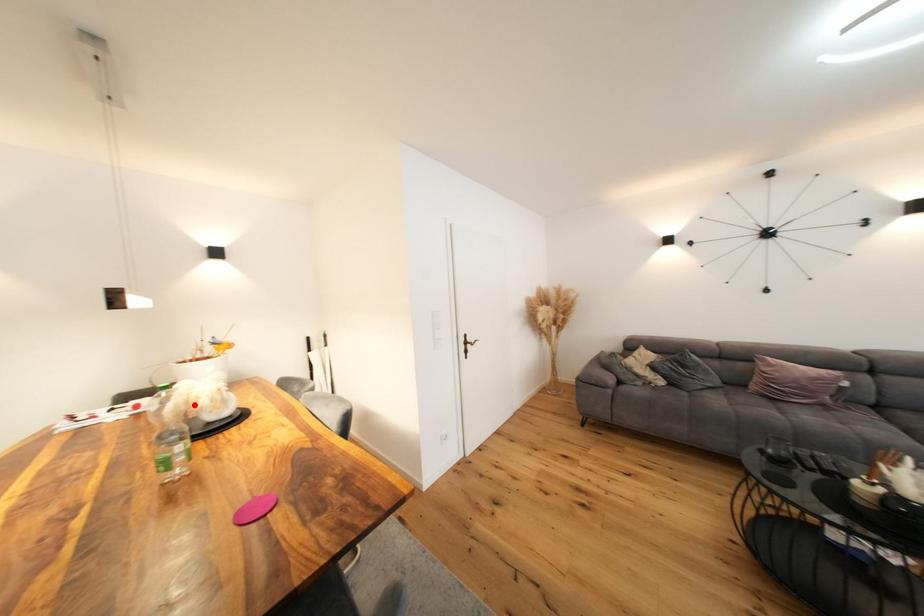
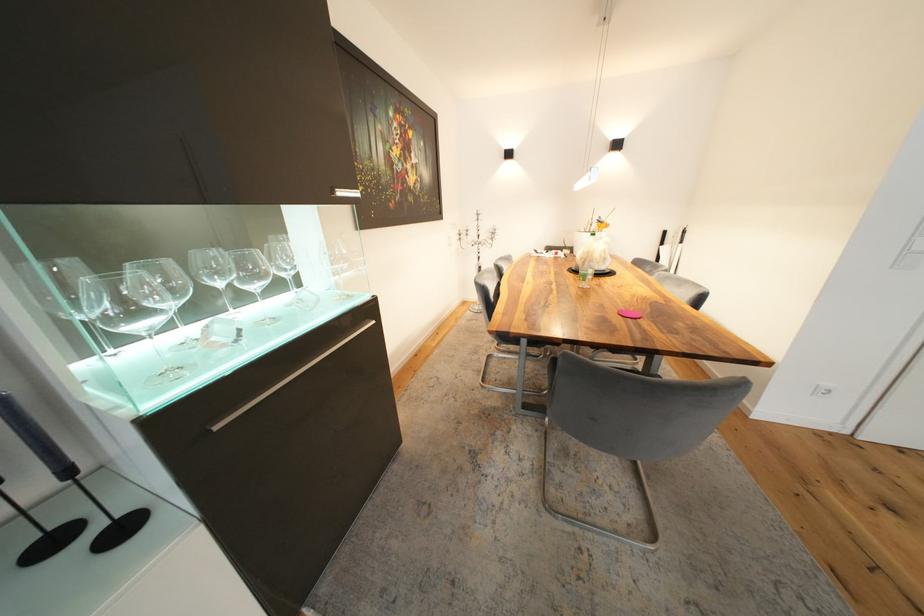
Question: I am providing you with two images of the same scene from different viewpoints. Given a red point in image1, look at the same physical point in image2. Is it:

Choices:
 (A) Closer to the viewpoint
 (B) Farther from the viewpoint

Answer: (A)